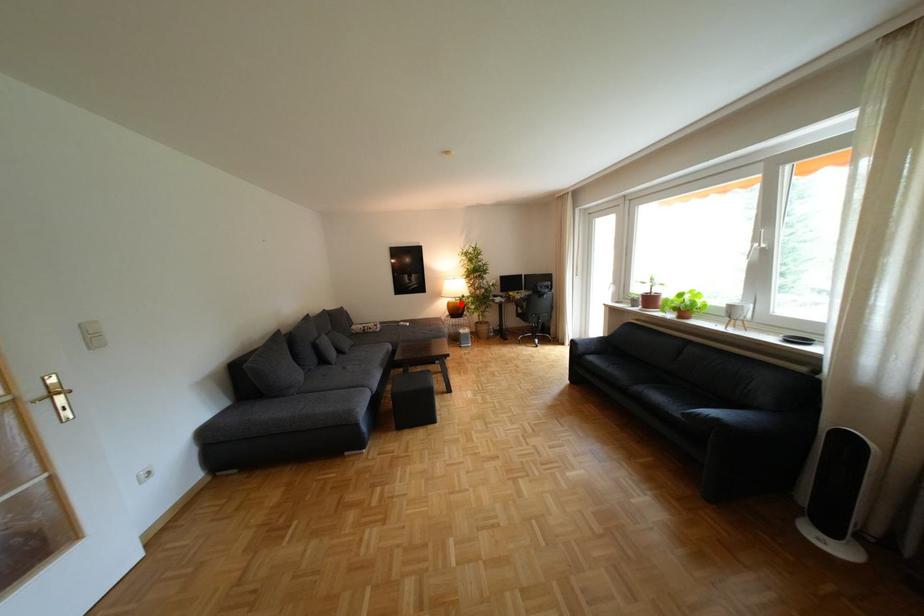
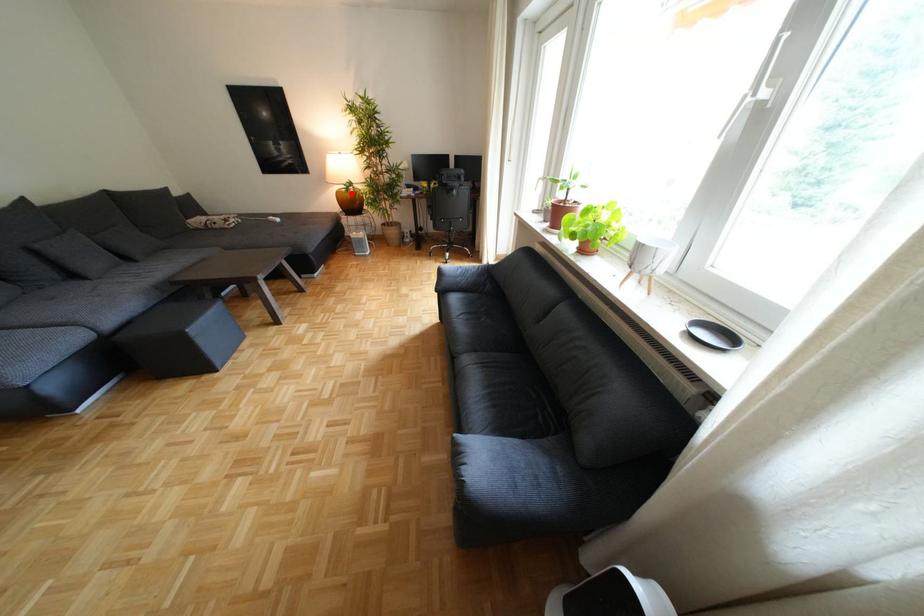
I am providing you with two images of the same scene from different viewpoints. A red point is marked on the first image and another point is marked on the second image. Is the red point in image1 aligned with the point shown in image2?

Yes